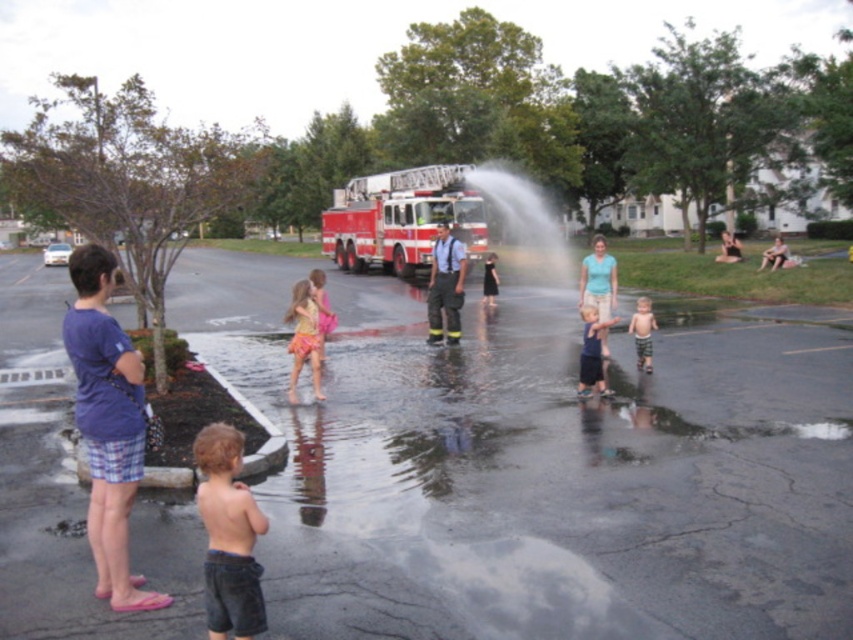
Question: Considering the real-world distances, which object is farthest from the clear water at center?

Choices:
 (A) floral fabric dress at center
 (B) purple fabric shirt at left
 (C) red shiny fire truck at center

Answer: (C)

Question: Can you confirm if light blue cotton shirt at center is positioned to the left of blurred fabric person at center?

Choices:
 (A) no
 (B) yes

Answer: (B)

Question: Which object is the farthest from the red shiny fire truck at center?

Choices:
 (A) light brown plaid shorts at lower center
 (B) black fabric dress at center
 (C) light blue cotton shirt at center

Answer: (A)

Question: Is reflective silver helmet at center to the left of dark blue denim shorts at center from the viewer's perspective?

Choices:
 (A) yes
 (B) no

Answer: (A)

Question: Which point is closer to the camera?

Choices:
 (A) light brown wooden chair at upper right
 (B) blurred fabric person at center
 (C) red shiny fire truck at center
 (D) dark blue denim shorts at center

Answer: (D)

Question: Can you confirm if clear water at center is smaller than floral fabric dress at center?

Choices:
 (A) no
 (B) yes

Answer: (A)